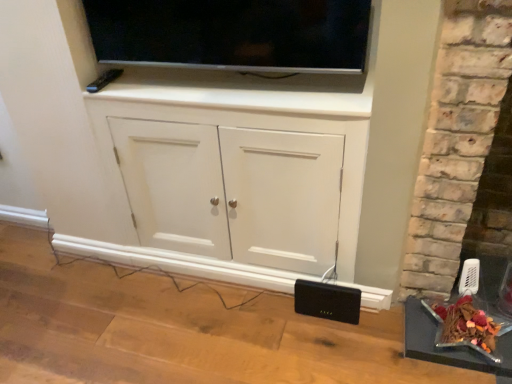
Question: Is metallic silver tray at lower right positioned beyond the bounds of white matte cabinet at center?

Choices:
 (A) no
 (B) yes

Answer: (B)

Question: From a real-world perspective, is metallic silver tray at lower right over white matte cabinet at center?

Choices:
 (A) yes
 (B) no

Answer: (B)

Question: Can you confirm if metallic silver tray at lower right is positioned to the left of white matte cabinet at center?

Choices:
 (A) no
 (B) yes

Answer: (A)

Question: Is metallic silver tray at lower right shorter than white matte cabinet at center?

Choices:
 (A) yes
 (B) no

Answer: (A)

Question: Is metallic silver tray at lower right bigger than white matte cabinet at center?

Choices:
 (A) no
 (B) yes

Answer: (A)

Question: Looking at their shapes, would you say matte black tv at upper center is wider or thinner than metallic silver tray at lower right?

Choices:
 (A) wide
 (B) thin

Answer: (B)

Question: From a real-world perspective, is matte black tv at upper center physically located above or below metallic silver tray at lower right?

Choices:
 (A) below
 (B) above

Answer: (B)

Question: Is matte black tv at upper center taller or shorter than metallic silver tray at lower right?

Choices:
 (A) tall
 (B) short

Answer: (A)

Question: From the image's perspective, is matte black tv at upper center located above or below metallic silver tray at lower right?

Choices:
 (A) above
 (B) below

Answer: (A)

Question: Is black plastic speaker at lower right in front of or behind matte black tv at upper center in the image?

Choices:
 (A) behind
 (B) front

Answer: (A)

Question: From a real-world perspective, is black plastic speaker at lower right physically located above or below matte black tv at upper center?

Choices:
 (A) below
 (B) above

Answer: (A)

Question: Considering the positions of black plastic speaker at lower right and matte black tv at upper center in the image, is black plastic speaker at lower right taller or shorter than matte black tv at upper center?

Choices:
 (A) tall
 (B) short

Answer: (B)

Question: Considering the positions of black plastic speaker at lower right and matte black tv at upper center in the image, is black plastic speaker at lower right bigger or smaller than matte black tv at upper center?

Choices:
 (A) small
 (B) big

Answer: (A)

Question: In the image, is metallic silver tray at lower right positioned in front of or behind black plastic speaker at lower right?

Choices:
 (A) behind
 (B) front

Answer: (B)

Question: Looking at their shapes, would you say metallic silver tray at lower right is wider or thinner than black plastic speaker at lower right?

Choices:
 (A) wide
 (B) thin

Answer: (A)